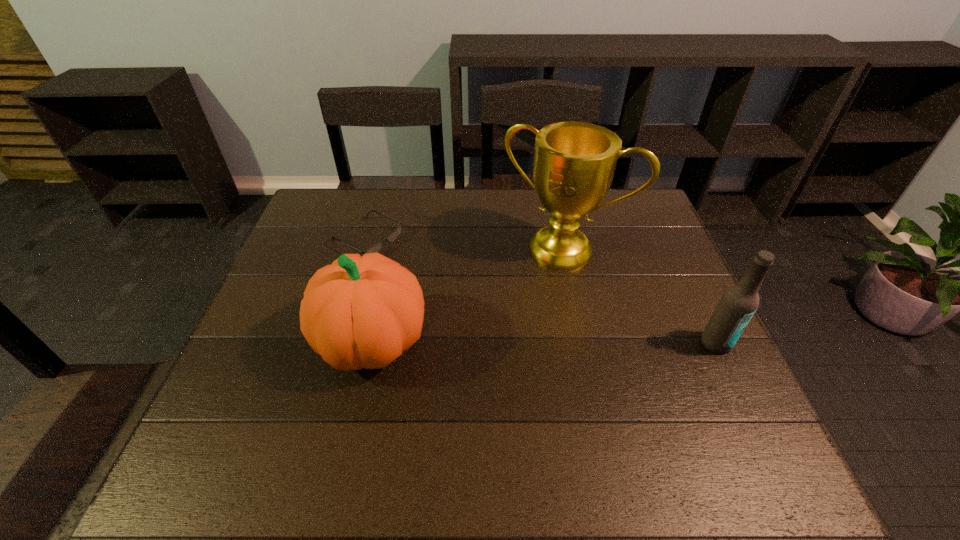
Find the location of a particular element. The height and width of the screenshot is (540, 960). free space on the desktop that is between the pumpkin and the beer bottle and is positioned on the shiny surface of the third object from left to right is located at coordinates (516, 342).

The height and width of the screenshot is (540, 960). I want to click on vacant space on the desktop that is between the pumpkin and the beer bottle and is positioned on the front-facing side of the shortest object, so (568, 342).